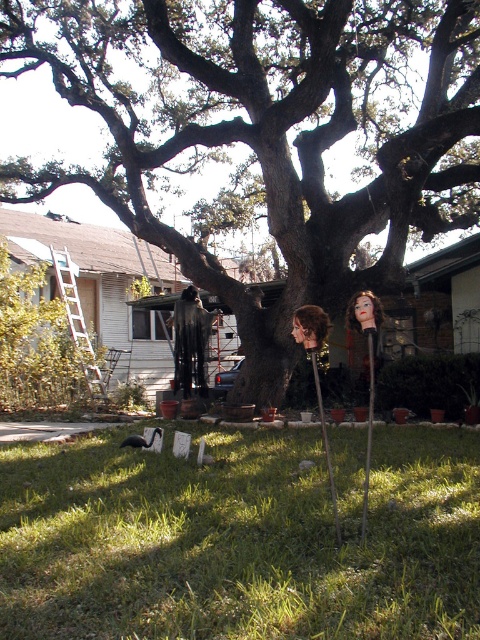
Is point (327, 428) farther from viewer compared to point (72, 301)?

No, (327, 428) is closer to viewer.

Who is shorter, green grass at lower center or metallic silver ladder at left?

green grass at lower center

Where is `green grass at lower center`? This screenshot has height=640, width=480. green grass at lower center is located at coordinates (241, 538).

Can you confirm if brown rough bark tree at center is wider than metallic silver ladder at left?

Correct, the width of brown rough bark tree at center exceeds that of metallic silver ladder at left.

Find the location of a particular element. brown rough bark tree at center is located at coordinates (266, 131).

Which of these two, brown rough bark tree at center or green grass at lower center, stands taller?

Standing taller between the two is brown rough bark tree at center.

Which is in front, point (299, 108) or point (115, 545)?

Point (115, 545) is more forward.

The height and width of the screenshot is (640, 480). Find the location of `brown rough bark tree at center`. brown rough bark tree at center is located at coordinates (266, 131).